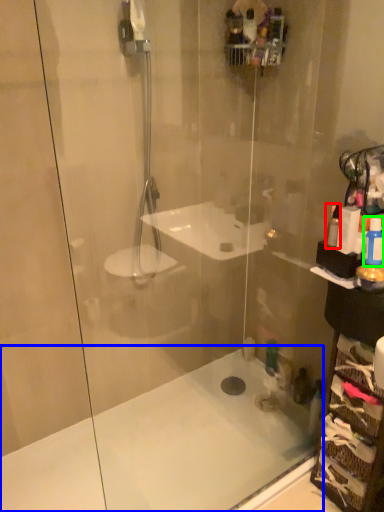
Question: Estimate the real-world distances between objects in this image. Which object is closer to toiletry (highlighted by a red box), bath (highlighted by a blue box) or toiletry (highlighted by a green box)?

Choices:
 (A) bath
 (B) toiletry

Answer: (B)